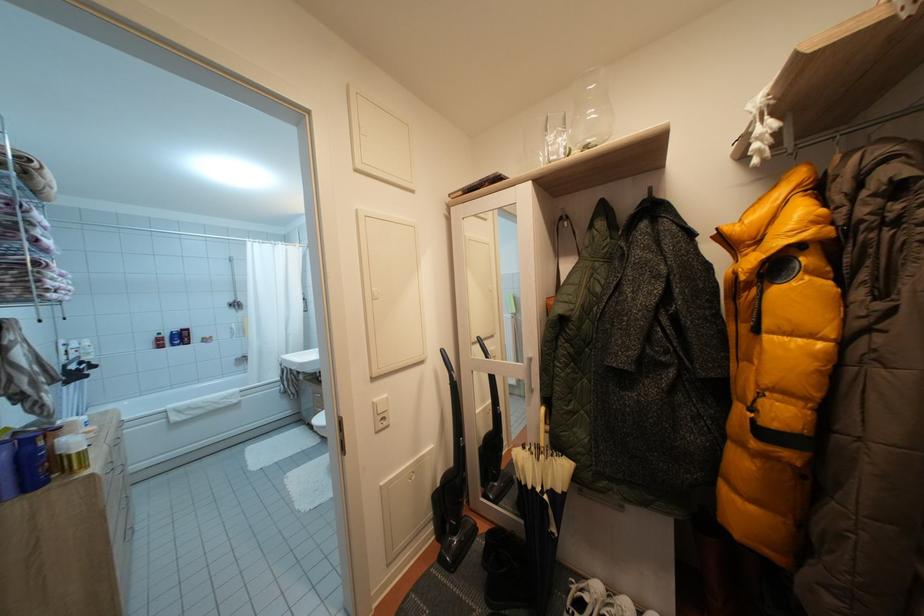
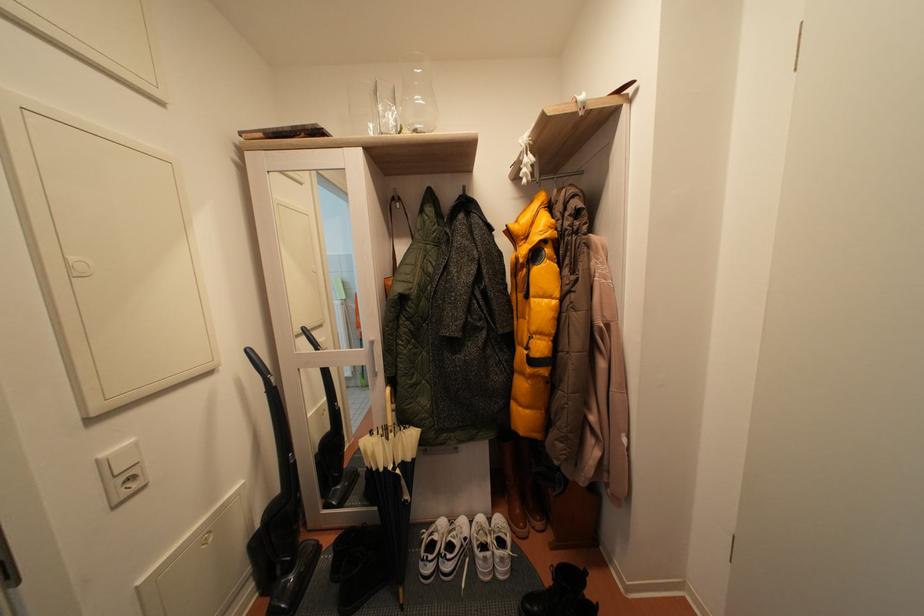
The point at (x=757, y=113) is marked in the first image. Where is the corresponding point in the second image?

(528, 147)